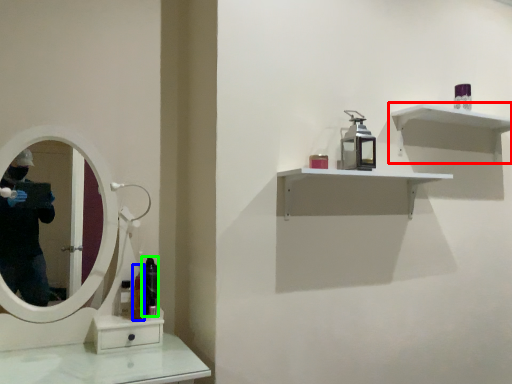
Question: Which is farther away from shelf (highlighted by a red box)? mouthwash (highlighted by a blue box) or mouthwash (highlighted by a green box)?

Choices:
 (A) mouthwash
 (B) mouthwash

Answer: (A)